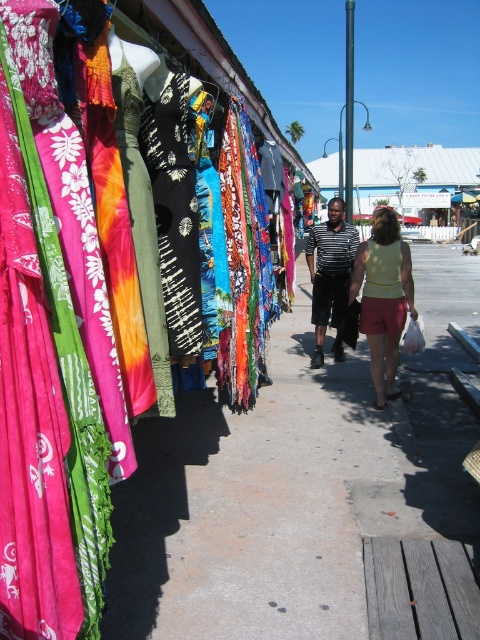
You are standing at the point marked by the coordinates point (x=296, y=484) in the market scene. Looking around, you see the clothing rack on the left and the two people walking on the pathway in the center. Which direction should you face to see the clothing rack on the left?

You should face to the left to see the clothing rack on the left, as the point marked by the coordinates point (x=296, y=484) is located at the smooth concrete sidewalk at center.

You are shopping at the market and see both the yellow cotton tank top at center and the striped cotton shirt at center. Which one is positioned to the right?

The yellow cotton tank top at center is positioned to the right of the striped cotton shirt at center.